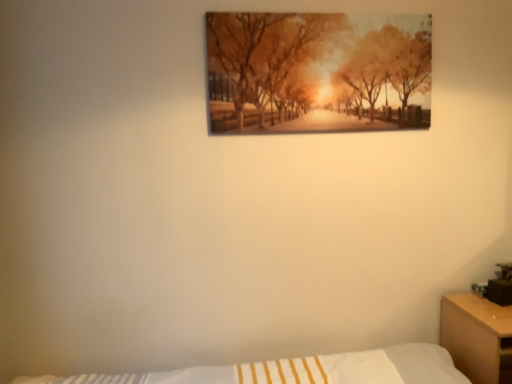
Find the location of a particular element. empty space that is ontop of matte wooden picture frame at upper center (from a real-world perspective) is located at coordinates (327, 5).